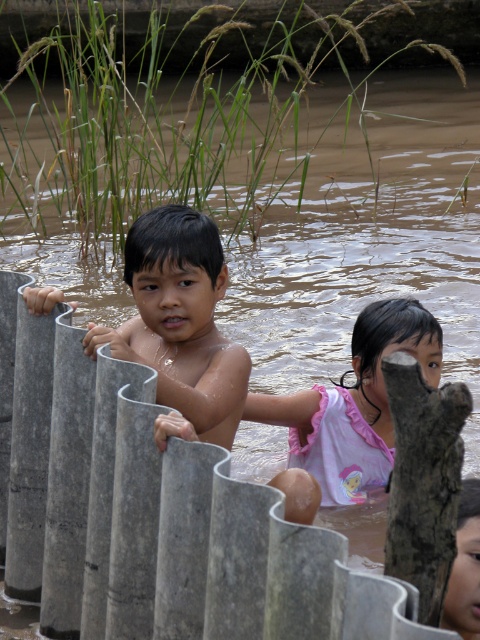
Question: Does smooth skin boy at center appear under pink cotton shirt at center?

Choices:
 (A) no
 (B) yes

Answer: (A)

Question: Does smooth skin boy at center have a smaller size compared to pink cotton shirt at center?

Choices:
 (A) yes
 (B) no

Answer: (A)

Question: Which of the following is the closest to the observer?

Choices:
 (A) pink cotton shirt at center
 (B) smooth skin boy at center

Answer: (B)

Question: Can you confirm if smooth skin boy at center is wider than pink cotton shirt at center?

Choices:
 (A) no
 (B) yes

Answer: (A)